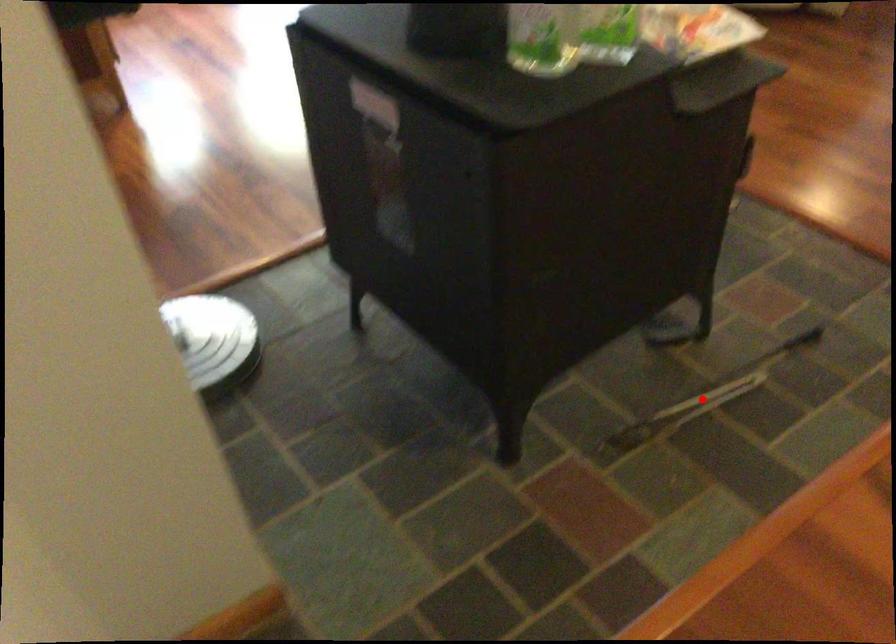
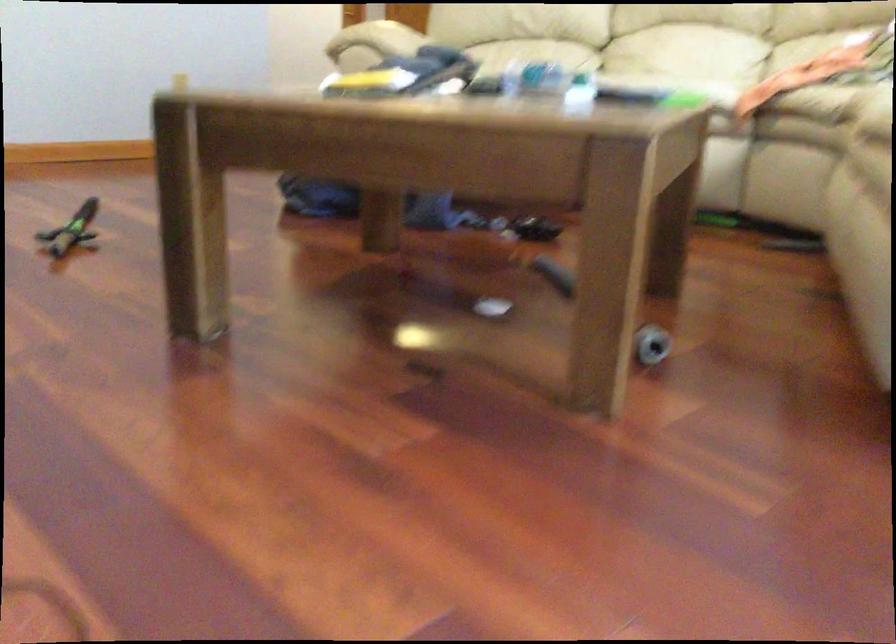
Question: I am providing you with two images of the same scene from different viewpoints. A red point is marked on the first image. Can you still see the location of the red point in image 2?

Choices:
 (A) Yes
 (B) No

Answer: (B)